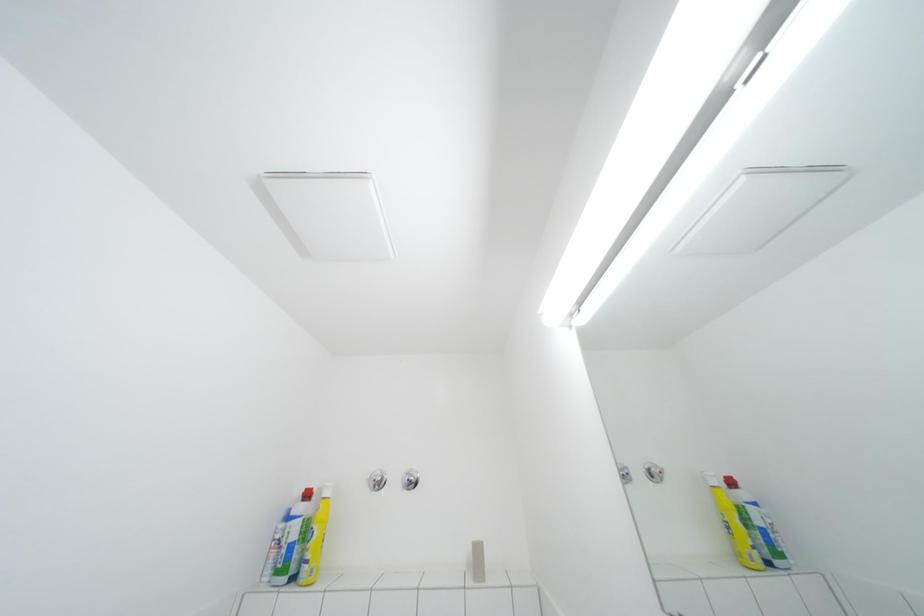
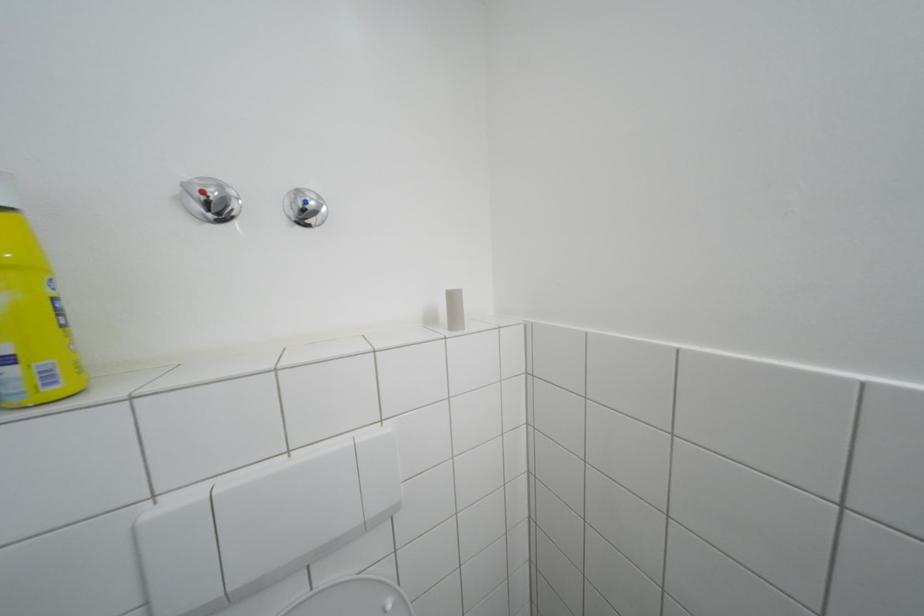
First-person continuous shooting, in which direction is the camera rotating?

The camera's rotation is toward right-down.